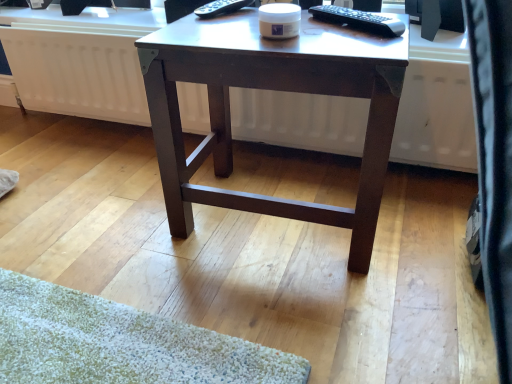
The image size is (512, 384). I want to click on free space to the right of dark brown wood desk at center, so click(416, 218).